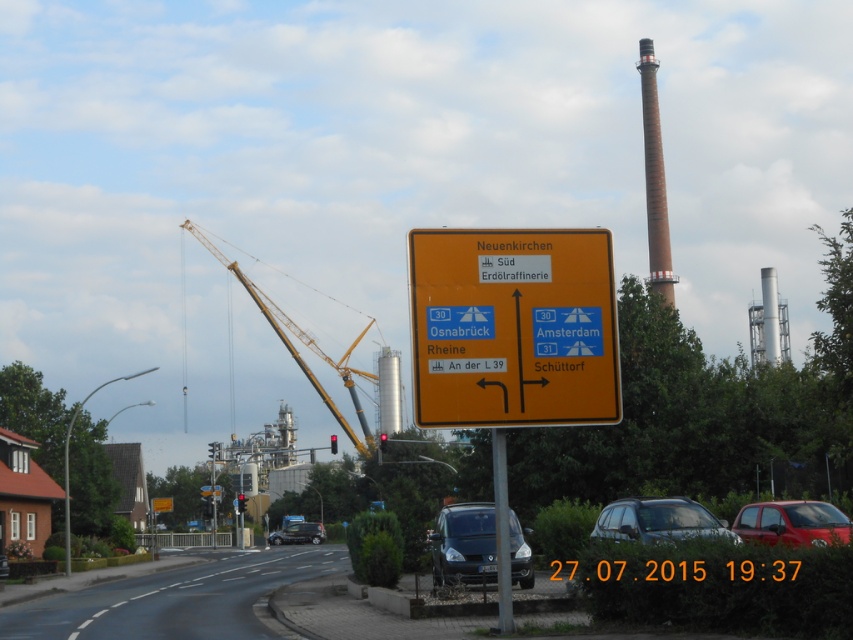
You are a delivery driver who needs to park your 2.5 meter wide truck near the intersection. You see the matte black van at center and the yellow metallic crane at left. Which vehicle has enough space for your truck to park next to it without overlapping?

The yellow metallic crane at left has a greater width than the matte black van at center. Since your truck is 2.5 meters wide, you should park next to the yellow metallic crane at left as it provides more space.

You are a delivery driver who needs to load a tall package onto your vehicle. You have two options at the intersection scene described. Which vehicle, the matte black van at center or the matte black car at center, would be more suitable for loading the tall package based on their heights?

The matte black car at center has a greater height than the matte black van at center, so it would be more suitable for loading the tall package.